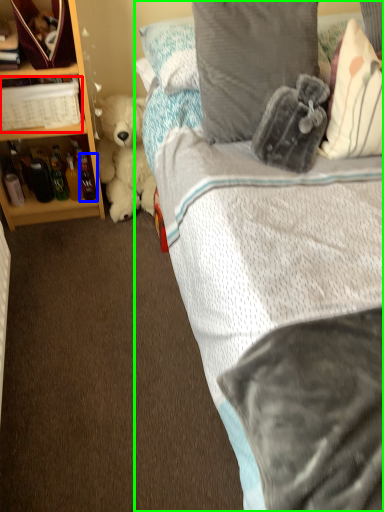
Question: Estimate the real-world distances between objects in this image. Which object is closer to book (highlighted by a red box), bottle (highlighted by a blue box) or bed (highlighted by a green box)?

Choices:
 (A) bottle
 (B) bed

Answer: (A)